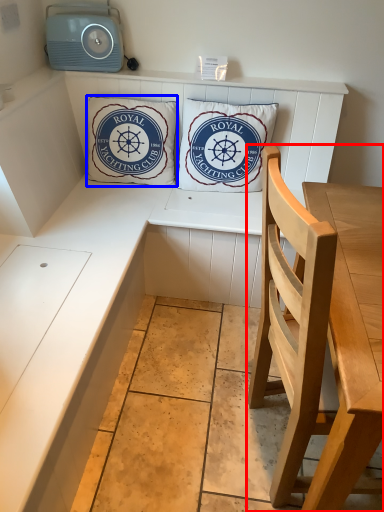
Question: Among these objects, which one is nearest to the camera, chair (highlighted by a red box) or pillow (highlighted by a blue box)?

Choices:
 (A) chair
 (B) pillow

Answer: (A)